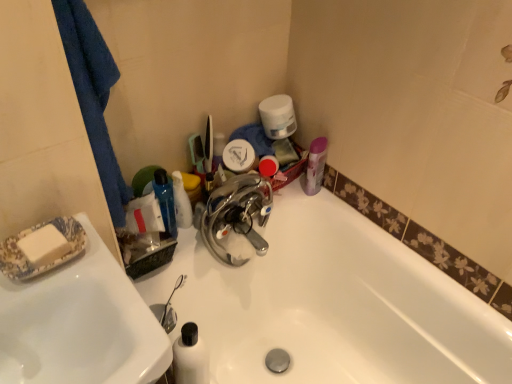
Measure the distance between point (266, 100) and camera.

Point (266, 100) is 4.14 feet away from camera.

The height and width of the screenshot is (384, 512). Find the location of `blue fabric towel at left`. blue fabric towel at left is located at coordinates (93, 94).

Is blue fabric towel at left smaller than white matte toilet paper at upper center?

No.

From a real-world perspective, who is located lower, blue fabric towel at left or white matte toilet paper at upper center?

From a 3D spatial view, white matte toilet paper at upper center is below.

Is white matte toilet paper at upper center inside blue fabric towel at left?

No, white matte toilet paper at upper center is not inside blue fabric towel at left.

Who is taller, white matte toilet paper at upper center or white glossy sink at left?

With more height is white glossy sink at left.

Where is `toilet paper above the white glossy sink at left (from a real-world perspective)`? The height and width of the screenshot is (384, 512). toilet paper above the white glossy sink at left (from a real-world perspective) is located at coordinates (278, 116).

Which object is further away from the camera taking this photo, white matte toilet paper at upper center or white glossy sink at left?

white matte toilet paper at upper center.

Is white matte toilet paper at upper center looking in the opposite direction of white glossy sink at left?

No, white matte toilet paper at upper center's orientation is not away from white glossy sink at left.

Can you tell me how much white glossy sink at left and white glossy bottle at upper center differ in facing direction?

The angle between the facing direction of white glossy sink at left and the facing direction of white glossy bottle at upper center is 45.3 degrees.

In the scene shown: Which object is positioned more to the right, white glossy sink at left or white glossy bottle at upper center?

Positioned to the right is white glossy bottle at upper center.

Based on their sizes in the image, would you say white glossy sink at left is bigger or smaller than white glossy bottle at upper center?

In the image, white glossy sink at left appears to be larger than white glossy bottle at upper center.

Does white glossy bottle at upper center appear on the right side of blue fabric towel at left?

Yes, white glossy bottle at upper center is to the right of blue fabric towel at left.

Would you say white glossy bottle at upper center is a long distance from blue fabric towel at left?

Actually, white glossy bottle at upper center and blue fabric towel at left are a little close together.

Which is closer to the camera, (184, 206) or (101, 61)?

Point (184, 206) is positioned farther from the camera compared to point (101, 61).

How far apart are white glossy bottle at upper center and blue fabric towel at left?

white glossy bottle at upper center and blue fabric towel at left are 12.85 inches apart.

The width and height of the screenshot is (512, 384). In order to click on toiletry directly beneath the white matte toilet paper at upper center (from a real-world perspective) in this screenshot , I will do click(181, 202).

Would you consider white matte toilet paper at upper center to be distant from white glossy bottle at upper center?

They are positioned close to each other.

Which object is wider, white matte toilet paper at upper center or white glossy bottle at upper center?

With larger width is white matte toilet paper at upper center.

Could you tell me if white glossy bottle at upper center is facing white glossy sink at left?

No.

Who is smaller, white glossy bottle at upper center or white glossy sink at left?

With smaller size is white glossy bottle at upper center.

Does white glossy bottle at upper center have a greater width compared to white glossy sink at left?

No.

From a real-world perspective, is white glossy bottle at upper center under white glossy sink at left?

Incorrect, from a real-world perspective, white glossy bottle at upper center is higher than white glossy sink at left.

Considering the sizes of blue fabric towel at left and white glossy bottle at upper center in the image, is blue fabric towel at left bigger or smaller than white glossy bottle at upper center?

Considering their sizes, blue fabric towel at left takes up more space than white glossy bottle at upper center.

This screenshot has width=512, height=384. I want to click on bath towel lying on the left of white glossy bottle at upper center, so click(93, 94).

Is point (79, 101) closer or farther from the camera than point (183, 223)?

Point (79, 101) is positioned closer to the camera compared to point (183, 223).

Looking at this image, how many degrees apart are the facing directions of blue fabric towel at left and white glossy bottle at upper center?

blue fabric towel at left and white glossy bottle at upper center are facing 45.5 degrees away from each other.

Identify the location of bath towel positioned vertically above the white matte toilet paper at upper center (from a real-world perspective). (93, 94).

Identify the location of toilet paper on the right of white glossy sink at left. The height and width of the screenshot is (384, 512). (278, 116).

Which object lies further to the anchor point white glossy bottle at upper center, white glossy sink at left or blue fabric towel at left?

white glossy sink at left.

From the image, which object appears to be nearer to white matte toilet paper at upper center, blue fabric towel at left or white glossy sink at left?

Based on the image, blue fabric towel at left appears to be nearer to white matte toilet paper at upper center.

Based on their spatial positions, is blue fabric towel at left or white matte toilet paper at upper center further from white glossy bottle at upper center?

Based on the image, white matte toilet paper at upper center appears to be further to white glossy bottle at upper center.

When comparing their distances from white glossy bottle at upper center, does white matte toilet paper at upper center or white glossy sink at left seem closer?

white matte toilet paper at upper center lies closer to white glossy bottle at upper center than the other object.

From the image, which object appears to be nearer to white glossy sink at left, white matte toilet paper at upper center or white glossy bottle at upper center?

The object closer to white glossy sink at left is white glossy bottle at upper center.

Consider the image. Considering their positions, is white glossy bottle at upper center positioned further to white matte toilet paper at upper center than blue fabric towel at left?

blue fabric towel at left lies further to white matte toilet paper at upper center than the other object.

When comparing their distances from white glossy sink at left, does white glossy bottle at upper center or white matte toilet paper at upper center seem further?

white matte toilet paper at upper center.

When comparing their distances from blue fabric towel at left, does white glossy bottle at upper center or white matte toilet paper at upper center seem closer?

Among the two, white glossy bottle at upper center is located nearer to blue fabric towel at left.

Identify the location of bath towel between white glossy sink at left and white matte toilet paper at upper center in the front-back direction. The image size is (512, 384). (93, 94).

You are a GUI agent. You are given a task and a screenshot of the screen. Output one action in this format:
    pyautogui.click(x=<x>, y=<y>)
    Task: Click on the toiletry located between blue fabric towel at left and white matte toilet paper at upper center in the depth direction
    The image size is (512, 384).
    Given the screenshot: What is the action you would take?
    pyautogui.click(x=181, y=202)

Locate an element on the screen. The image size is (512, 384). bath towel positioned between white glossy sink at left and white glossy bottle at upper center from near to far is located at coordinates (93, 94).

I want to click on toiletry between white glossy sink at left and white matte toilet paper at upper center from front to back, so click(x=181, y=202).